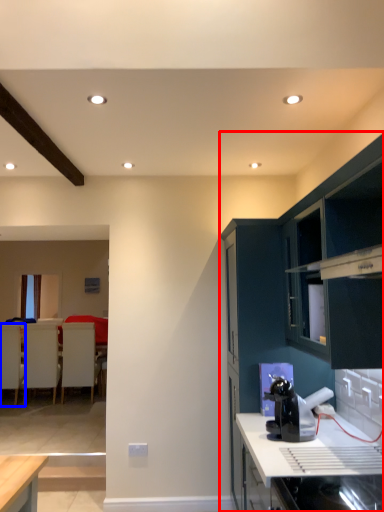
Question: Among these objects, which one is farthest to the camera, cabinetry (highlighted by a red box) or armchair (highlighted by a blue box)?

Choices:
 (A) cabinetry
 (B) armchair

Answer: (B)